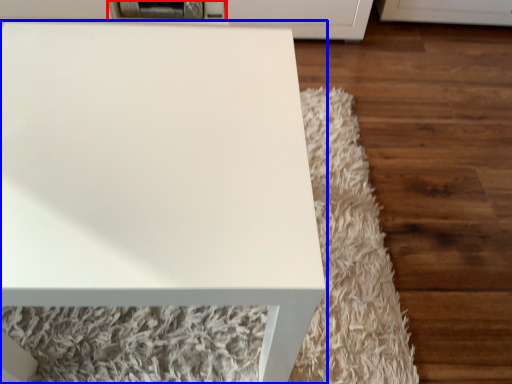
Question: Among these objects, which one is farthest to the camera, appliance (highlighted by a red box) or table (highlighted by a blue box)?

Choices:
 (A) appliance
 (B) table

Answer: (A)